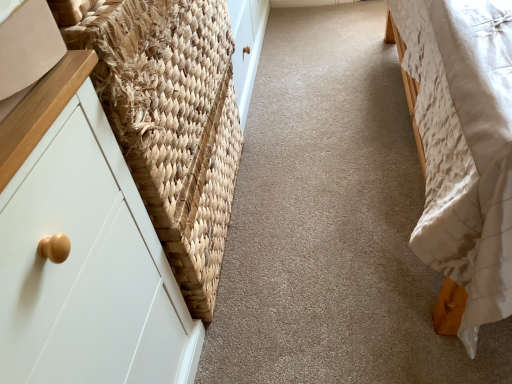
Question: Would you say white quilted fabric bed at right contains natural woven basket at left?

Choices:
 (A) yes
 (B) no

Answer: (B)

Question: Considering the relative positions of white quilted fabric bed at right and natural woven basket at left in the image provided, is white quilted fabric bed at right behind natural woven basket at left?

Choices:
 (A) no
 (B) yes

Answer: (A)

Question: Considering the relative positions of white quilted fabric bed at right and natural woven basket at left in the image provided, is white quilted fabric bed at right to the left of natural woven basket at left from the viewer's perspective?

Choices:
 (A) yes
 (B) no

Answer: (B)

Question: From the image's perspective, is white quilted fabric bed at right under natural woven basket at left?

Choices:
 (A) no
 (B) yes

Answer: (A)

Question: Is white quilted fabric bed at right not inside natural woven basket at left?

Choices:
 (A) yes
 (B) no

Answer: (A)

Question: Is white quilted fabric bed at right closer to the viewer compared to natural woven basket at left?

Choices:
 (A) no
 (B) yes

Answer: (B)

Question: From a real-world perspective, is natural woven basket at left physically below white quilted fabric bed at right?

Choices:
 (A) yes
 (B) no

Answer: (B)

Question: Is natural woven basket at left completely or partially outside of white quilted fabric bed at right?

Choices:
 (A) yes
 (B) no

Answer: (A)

Question: Is natural woven basket at left to the right of white quilted fabric bed at right from the viewer's perspective?

Choices:
 (A) yes
 (B) no

Answer: (B)

Question: Could you tell me if natural woven basket at left is turned towards white quilted fabric bed at right?

Choices:
 (A) yes
 (B) no

Answer: (A)

Question: Considering the relative sizes of natural woven basket at left and white quilted fabric bed at right in the image provided, is natural woven basket at left bigger than white quilted fabric bed at right?

Choices:
 (A) yes
 (B) no

Answer: (B)

Question: Can you confirm if natural woven basket at left is smaller than white quilted fabric bed at right?

Choices:
 (A) no
 (B) yes

Answer: (B)

Question: Considering the relative positions of white quilted fabric bed at right and natural woven basket at left in the image provided, is white quilted fabric bed at right to the left or to the right of natural woven basket at left?

Choices:
 (A) left
 (B) right

Answer: (B)